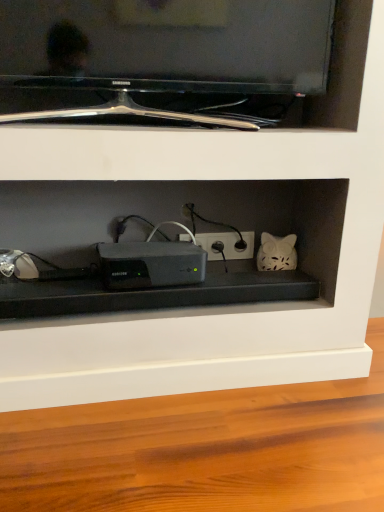
Question: From a real-world perspective, does sleek black device at center sit lower than black glossy tv at upper center?

Choices:
 (A) no
 (B) yes

Answer: (B)

Question: Does sleek black device at center appear on the right side of black glossy tv at upper center?

Choices:
 (A) yes
 (B) no

Answer: (B)

Question: From the image's perspective, is sleek black device at center located beneath black glossy tv at upper center?

Choices:
 (A) yes
 (B) no

Answer: (A)

Question: Does sleek black device at center have a lesser width compared to black glossy tv at upper center?

Choices:
 (A) no
 (B) yes

Answer: (A)

Question: Is sleek black device at center not inside black glossy tv at upper center?

Choices:
 (A) yes
 (B) no

Answer: (A)

Question: Which is correct: white matte cat at center-right is inside sleek black device at center, or outside of it?

Choices:
 (A) outside
 (B) inside

Answer: (A)

Question: From the image's perspective, is white matte cat at center-right located above or below sleek black device at center?

Choices:
 (A) above
 (B) below

Answer: (A)

Question: Based on their sizes in the image, would you say white matte cat at center-right is bigger or smaller than sleek black device at center?

Choices:
 (A) small
 (B) big

Answer: (A)

Question: Is white matte cat at center-right taller or shorter than sleek black device at center?

Choices:
 (A) tall
 (B) short

Answer: (A)

Question: Based on their sizes in the image, would you say white plastic electric outlet at center is bigger or smaller than white matte cat at center-right?

Choices:
 (A) small
 (B) big

Answer: (A)

Question: In the image, is white plastic electric outlet at center positioned in front of or behind white matte cat at center-right?

Choices:
 (A) front
 (B) behind

Answer: (B)

Question: Is white plastic electric outlet at center inside the boundaries of white matte cat at center-right, or outside?

Choices:
 (A) inside
 (B) outside

Answer: (B)

Question: From a real-world perspective, is white plastic electric outlet at center physically located above or below white matte cat at center-right?

Choices:
 (A) below
 (B) above

Answer: (A)

Question: Does point (241, 250) appear closer or farther from the camera than point (175, 53)?

Choices:
 (A) farther
 (B) closer

Answer: (A)

Question: From their relative heights in the image, would you say white plastic electric outlet at center is taller or shorter than black glossy tv at upper center?

Choices:
 (A) tall
 (B) short

Answer: (B)